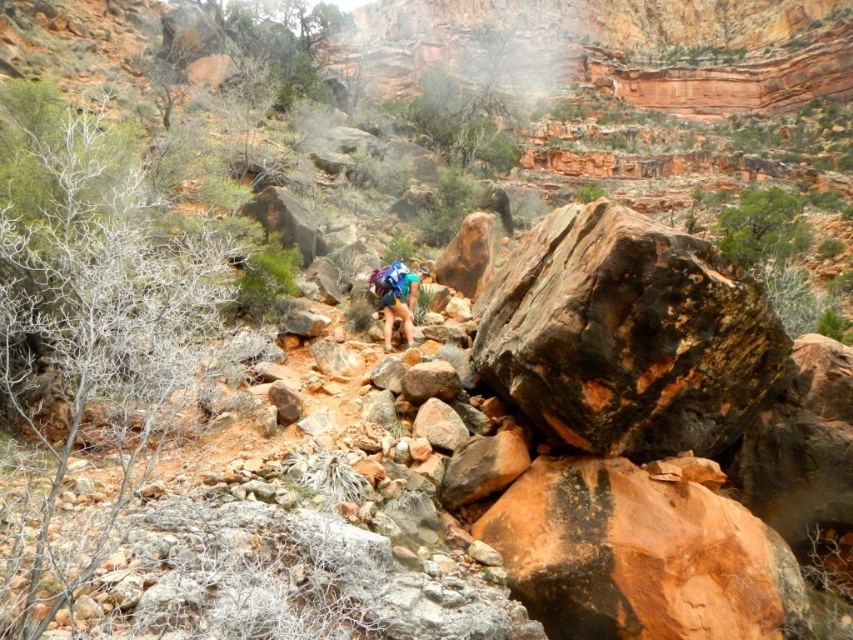
Question: Is rusty brown rock at right to the right of blue fabric backpack at center from the viewer's perspective?

Choices:
 (A) yes
 (B) no

Answer: (A)

Question: Which point appears closest to the camera in this image?

Choices:
 (A) (422, 278)
 (B) (567, 356)

Answer: (B)

Question: Among these objects, which one is farthest from the camera?

Choices:
 (A) rusty brown rock at right
 (B) blue fabric backpack at center

Answer: (B)

Question: Is rusty brown rock at right positioned at the back of blue fabric backpack at center?

Choices:
 (A) yes
 (B) no

Answer: (B)

Question: Is rusty brown rock at right above blue fabric backpack at center?

Choices:
 (A) no
 (B) yes

Answer: (A)